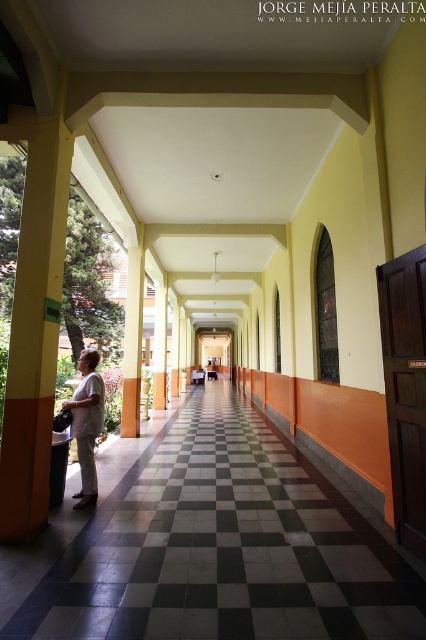
Who is lower down, white matte shirt at center or orange painted pillar at center?

white matte shirt at center is below.

Which of these two, white matte shirt at center or orange painted pillar at center, stands shorter?

Standing shorter between the two is white matte shirt at center.

Between point (74, 404) and point (123, 401), which one is positioned behind?

Point (123, 401)

Where is `white matte shirt at center`? The width and height of the screenshot is (426, 640). white matte shirt at center is located at coordinates (86, 422).

Looking at this image, is yellow painted wood column at left below white matte shirt at center?

No.

The height and width of the screenshot is (640, 426). In order to click on yellow painted wood column at left in this screenshot , I will do `click(34, 333)`.

Can you confirm if black tile corridor at center is positioned above yellow painted wood column at left?

Incorrect, black tile corridor at center is not positioned above yellow painted wood column at left.

Which is more to the left, black tile corridor at center or yellow painted wood column at left?

From the viewer's perspective, yellow painted wood column at left appears more on the left side.

Which is behind, point (176, 628) or point (60, 248)?

Point (60, 248)

You are a GUI agent. You are given a task and a screenshot of the screen. Output one action in this format:
    pyautogui.click(x=<x>, y=<y>)
    Task: Click on the black tile corridor at center
    This screenshot has height=640, width=426.
    Given the screenshot: What is the action you would take?
    pyautogui.click(x=224, y=545)